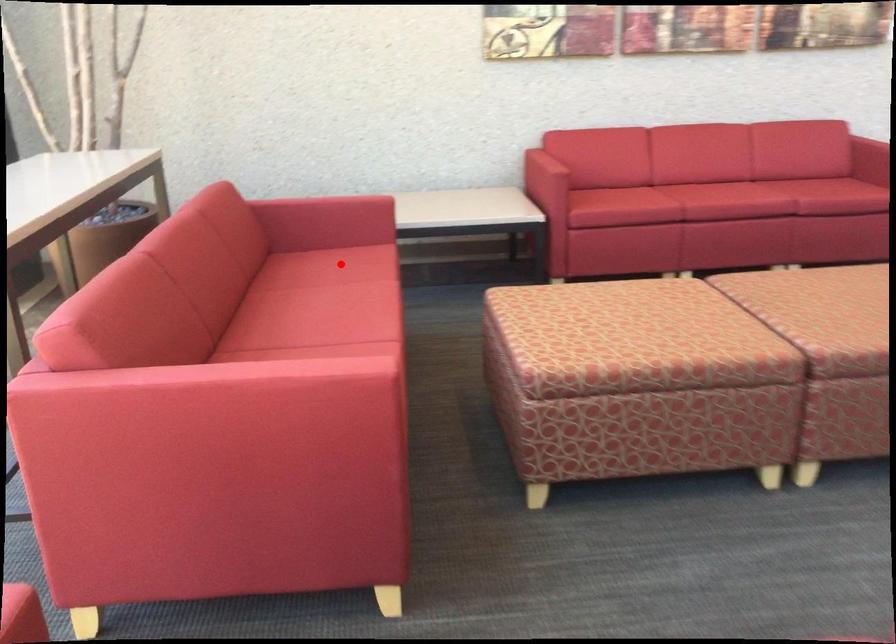
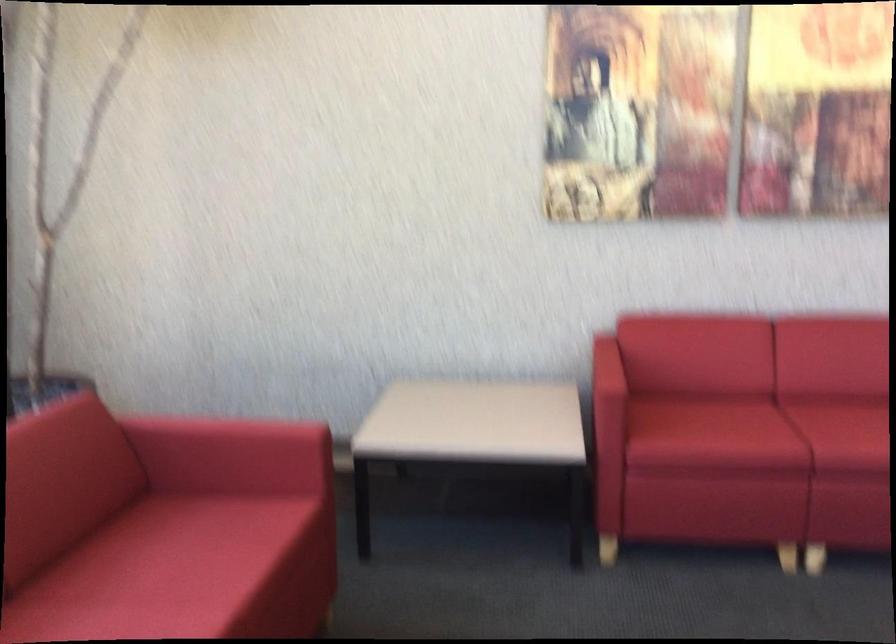
Question: I am providing you with two images of the same scene from different viewpoints. A red point is shown in image1. For the corresponding object point in image2, is it positioned nearer or farther from the camera?

Choices:
 (A) Nearer
 (B) Farther

Answer: (A)